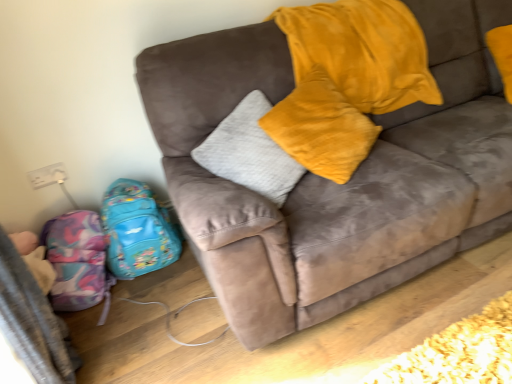
Question: Is multicolored fabric backpack at lower left, the second luggage in the right-to-left sequence, wider or thinner than shiny blue backpack at lower left, which is counted as the 2th luggage, starting from the left?

Choices:
 (A) thin
 (B) wide

Answer: (B)

Question: From the image's perspective, is multicolored fabric backpack at lower left, placed as the first luggage when sorted from left to right, positioned above or below shiny blue backpack at lower left, which ranks as the 1th luggage in right-to-left order?

Choices:
 (A) above
 (B) below

Answer: (B)

Question: Based on their relative distances, which object is nearer to the velvet yellow pillow at upper center?

Choices:
 (A) suede couch at center
 (B) multicolored fabric backpack at lower left, placed as the first luggage when sorted from left to right
 (C) shiny blue backpack at lower left, which is counted as the 2th luggage, starting from the left

Answer: (A)

Question: Which is farther from the velvet yellow pillow at upper center?

Choices:
 (A) multicolored fabric backpack at lower left, placed as the first luggage when sorted from left to right
 (B) suede couch at center
 (C) shiny blue backpack at lower left, which is counted as the 2th luggage, starting from the left

Answer: (A)